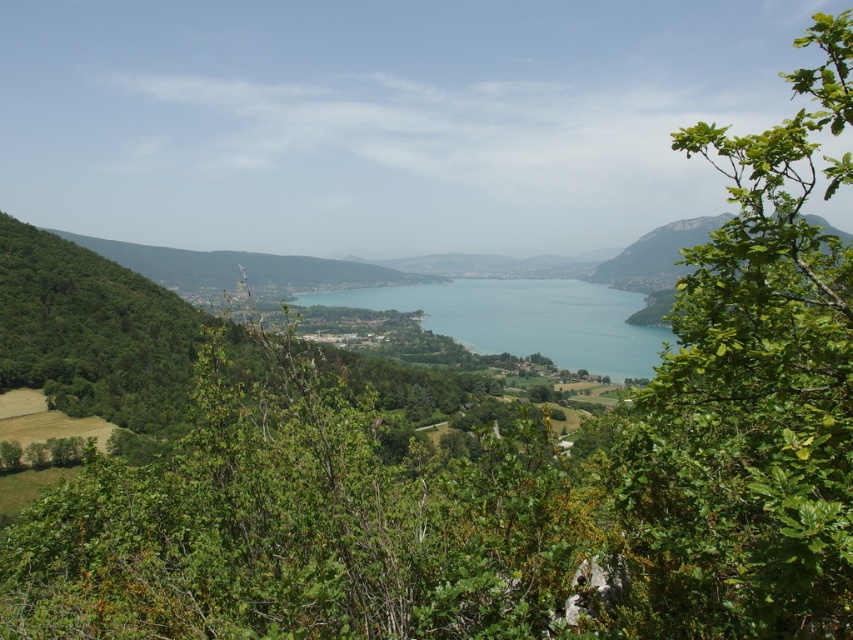
Who is positioned more to the right, green leafy tree at center or green leafy tree at right?

green leafy tree at right

Is green leafy tree at center above green leafy tree at right?

No, green leafy tree at center is not above green leafy tree at right.

The image size is (853, 640). Describe the element at coordinates (300, 525) in the screenshot. I see `green leafy tree at center` at that location.

What are the coordinates of `green leafy tree at center` in the screenshot? It's located at (300, 525).

Is green leafy tree at center above blue water at center?

Actually, green leafy tree at center is below blue water at center.

Between point (200, 419) and point (589, 284), which one is positioned behind?

The point (589, 284) is more distant.

Between point (206, 470) and point (556, 301), which one is positioned behind?

The point (556, 301) is more distant.

Image resolution: width=853 pixels, height=640 pixels. I want to click on green leafy tree at center, so click(300, 525).

Is green leafy tree at right below blue water at center?

No, green leafy tree at right is not below blue water at center.

Who is higher up, green leafy tree at right or blue water at center?

Positioned higher is green leafy tree at right.

Find the location of a particular element. green leafy tree at right is located at coordinates (747, 403).